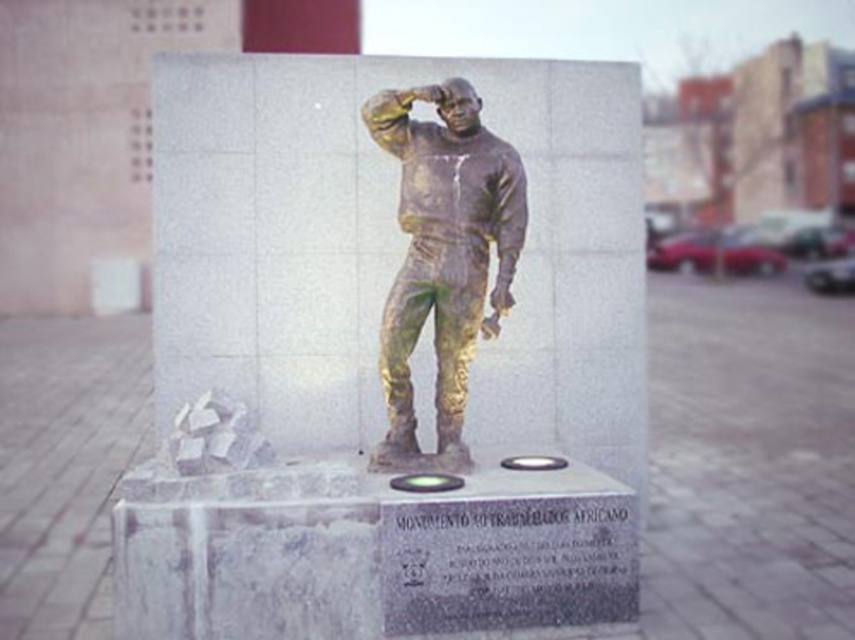
Does bronze statue at center have a greater width compared to gold patina astronaut at center?

Yes.

Who is more forward, (252, 609) or (470, 348)?

Point (252, 609) is in front.

Locate an element on the screen. bronze statue at center is located at coordinates (387, 352).